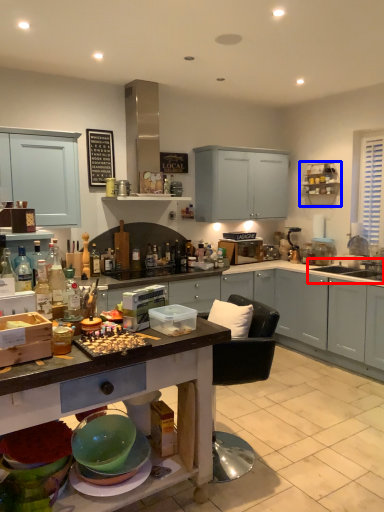
Question: Which point is further to the camera, sink (highlighted by a red box) or cabinet (highlighted by a blue box)?

Choices:
 (A) sink
 (B) cabinet

Answer: (B)